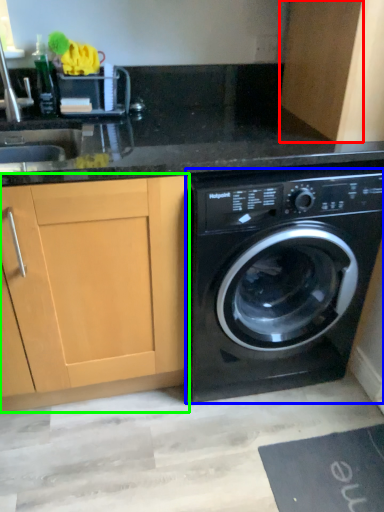
Question: Which object is the farthest from cabinetry (highlighted by a red box)? Choose among these: washing machine (highlighted by a blue box) or cabinetry (highlighted by a green box).

Choices:
 (A) washing machine
 (B) cabinetry

Answer: (B)